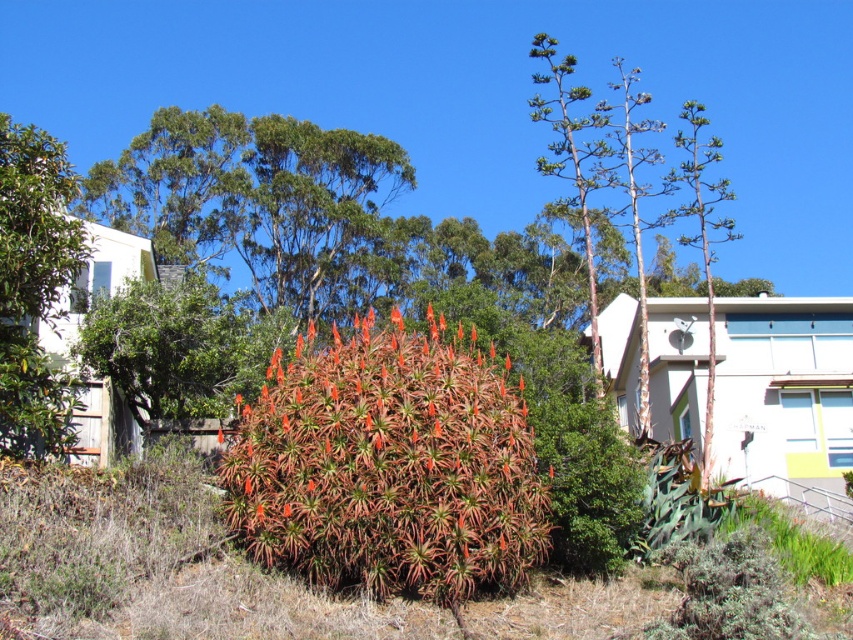
You are standing in the garden and want to water the green succulent at center and the green glossy leafy tree at left. Which one should you water first if you are facing the garden from the front?

The green succulent at center is to the right of the green glossy leafy tree at left, so you should water the green glossy leafy tree at left first since it is on your left side when facing the garden from the front.

You are a gardener who needs to water both the green succulent at center and the green glossy leafy tree at left. Your watering can has a range of 5 meters. Can you water both plants without moving your position? Explain your reasoning.

The green succulent at center and the green glossy leafy tree at left are 5.18 meters apart. Since your watering can has a range of 5 meters, you cannot water both plants without moving because the distance between them exceeds the canister range.